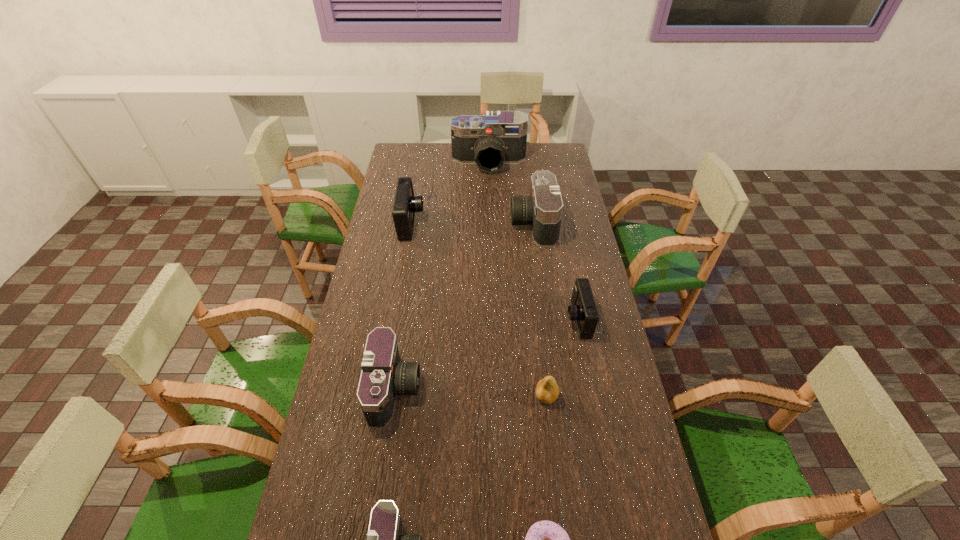
Identify which object is located as the second nearest to the second nearest camera. Please provide its 2D coordinates. Your answer should be formatted as a tuple, i.e. [(x, y)], where the tuple contains the x and y coordinates of a point satisfying the conditions above.

[(547, 390)]

Where is `camera that is the closest to the farthest camera`? This screenshot has width=960, height=540. camera that is the closest to the farthest camera is located at coordinates (543, 209).

This screenshot has height=540, width=960. Find the location of `camera that can be found as the second closest to the third nearest black camera`. camera that can be found as the second closest to the third nearest black camera is located at coordinates 583,310.

Locate an element on the screen. The height and width of the screenshot is (540, 960). black camera that is the closest to the right blue camera is located at coordinates (543, 209).

Locate which black camera ranks second in proximity to the pear. Please provide its 2D coordinates. Your answer should be formatted as a tuple, i.e. [(x, y)], where the tuple contains the x and y coordinates of a point satisfying the conditions above.

[(384, 539)]

Locate an element on the screen. The height and width of the screenshot is (540, 960). vacant area that satisfies the following two spatial constraints: 1. on the front-facing side of the pear; 2. on the right side of the fifth farthest camera is located at coordinates (394, 396).

The width and height of the screenshot is (960, 540). In order to click on free location that satisfies the following two spatial constraints: 1. on the front-facing side of the pear; 2. on the right side of the biggest black camera in this screenshot , I will do `click(494, 396)`.